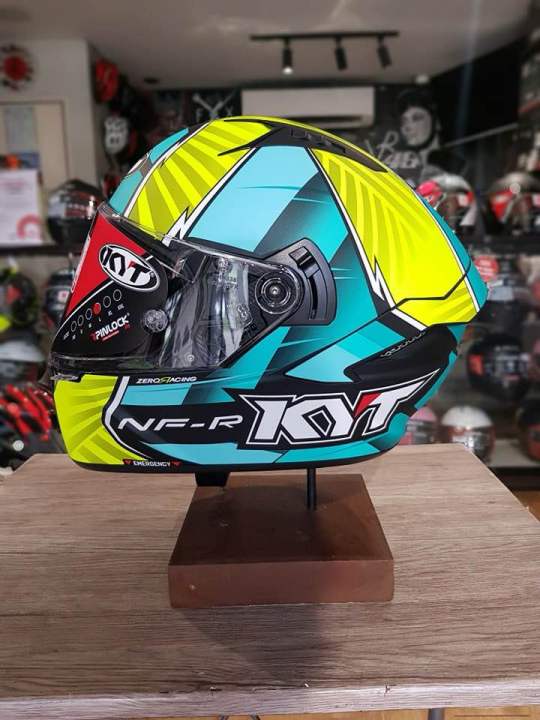
Locate an element on the screen. Image resolution: width=540 pixels, height=720 pixels. ceiling is located at coordinates 219,26.